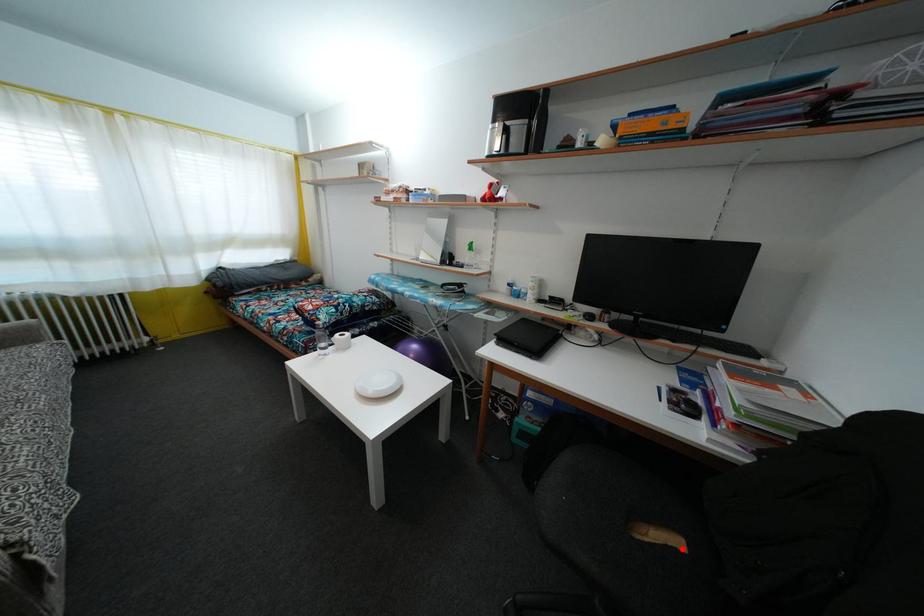
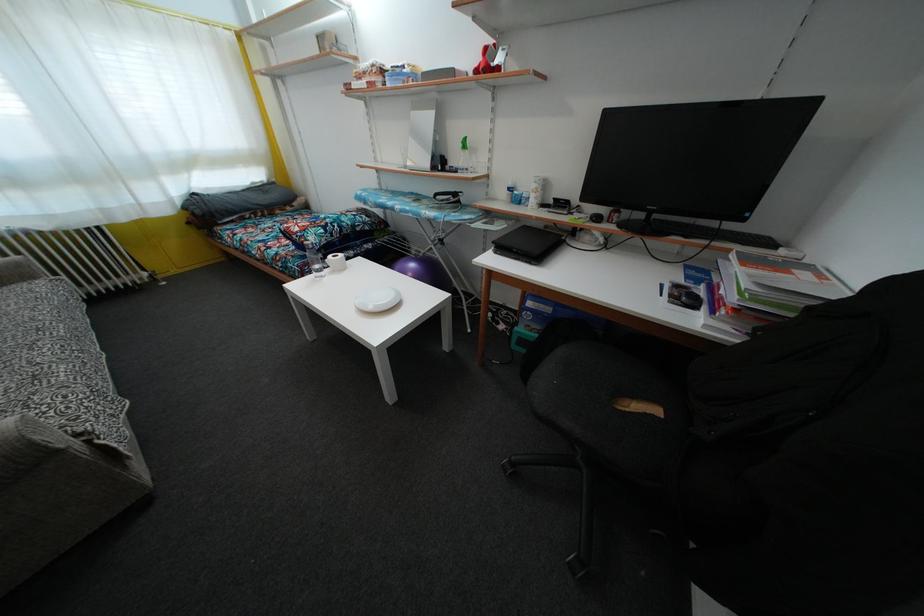
Question: I am providing you with two images of the same scene from different viewpoints. A red point is marked on the first image. Is the red point's position out of view in image 2?

Choices:
 (A) Yes
 (B) No

Answer: (B)